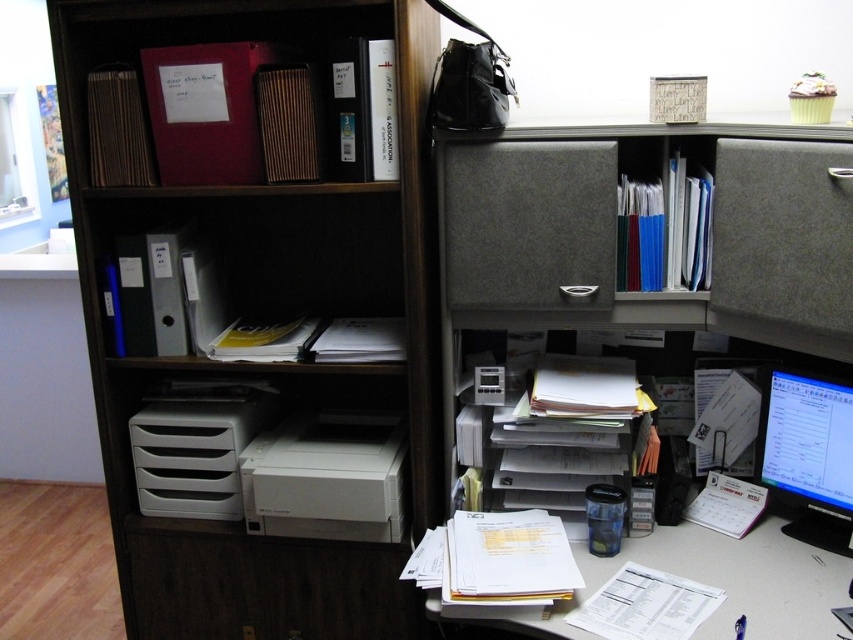
You are organizing the cubicle and need to move the gray fabric drawer at center to make space for a new item. Where is the white matte printer at center in relation to the drawer?

The gray fabric drawer at center is located above the white matte printer at center, so the printer is below the drawer.

You are organizing the office and need to place a new item on the gray fabric bookcase at right. To do this, you must first move an item from the white plastic printer at center. Which object should you move first?

The gray fabric bookcase at right is located above the white plastic printer at center, so you should move the white plastic printer at center first to access the bookcase.

You are organizing the cubicle shelves and need to place a new item that requires a taller space. Between the gray fabric drawer at center and the white matte printer at center, which one has enough vertical space for the item?

The gray fabric drawer at center is taller than the white matte printer at center, so it has enough vertical space for the item.